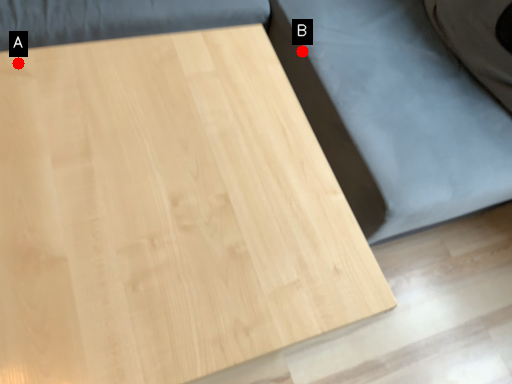
Question: Two points are circled on the image, labeled by A and B beside each circle. Which point is closer to the camera?

Choices:
 (A) A is closer
 (B) B is closer

Answer: (A)